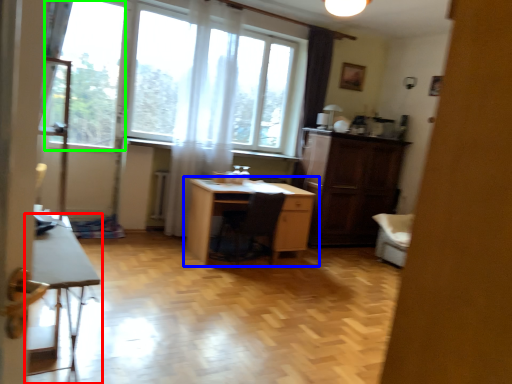
Question: Which object is the farthest from table (highlighted by a red box)? Choose among these: desk (highlighted by a blue box) or window screen (highlighted by a green box).

Choices:
 (A) desk
 (B) window screen

Answer: (B)